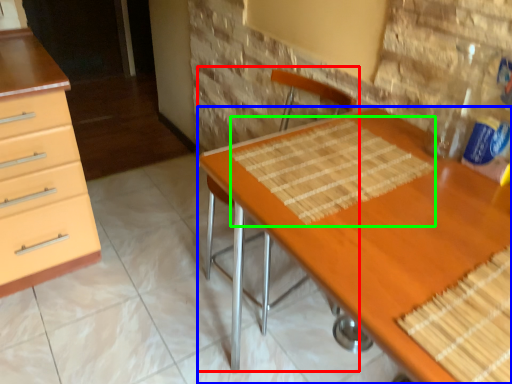
Question: Which object is positioned closest to armchair (highlighted by a red box)? Select from desk (highlighted by a blue box) and place mat (highlighted by a green box).

Choices:
 (A) desk
 (B) place mat

Answer: (B)